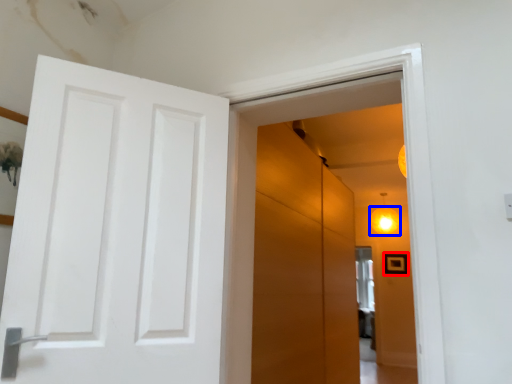
Question: Which point is closer to the camera, picture frame (highlighted by a red box) or lighting (highlighted by a blue box)?

Choices:
 (A) picture frame
 (B) lighting

Answer: (B)